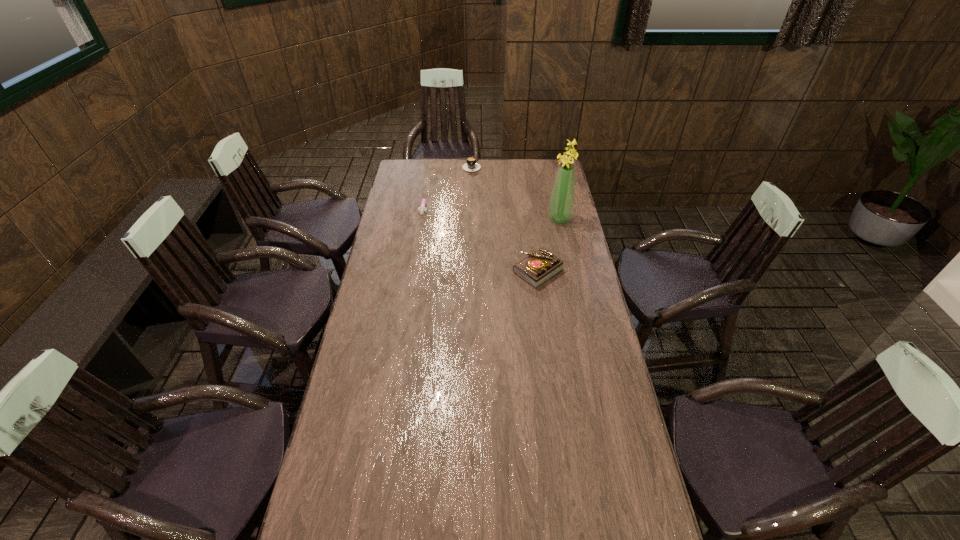
Locate an element on the screen. the leftmost object is located at coordinates (422, 209).

Where is `the shortest object`? the shortest object is located at coordinates pyautogui.click(x=422, y=209).

Locate an element on the screen. This screenshot has height=540, width=960. the nearest object is located at coordinates (537, 268).

Where is `bouquet`? bouquet is located at coordinates (561, 204).

You are a GUI agent. You are given a task and a screenshot of the screen. Output one action in this format:
    pyautogui.click(x=<x>, y=<y>)
    Task: Click on the second object from left to right
    
    Given the screenshot: What is the action you would take?
    pyautogui.click(x=471, y=165)

At what (x,y) coordinates should I click in order to perform the action: click on the farthest object. Please return your answer as a coordinate pair (x, y). The height and width of the screenshot is (540, 960). Looking at the image, I should click on (471, 165).

At what (x,y) coordinates should I click in order to perform the action: click on blank space located on the front of the shortest object. Please return your answer as a coordinate pair (x, y). This screenshot has height=540, width=960. Looking at the image, I should click on (420, 233).

Locate an element on the screen. The image size is (960, 540). free region located on the back of the nearest object is located at coordinates (534, 240).

Identify the location of vacant area situated on the front-facing side of the tallest object. (502, 227).

This screenshot has height=540, width=960. I want to click on vacant area located 0.240m on the front-facing side of the tallest object, so click(x=500, y=227).